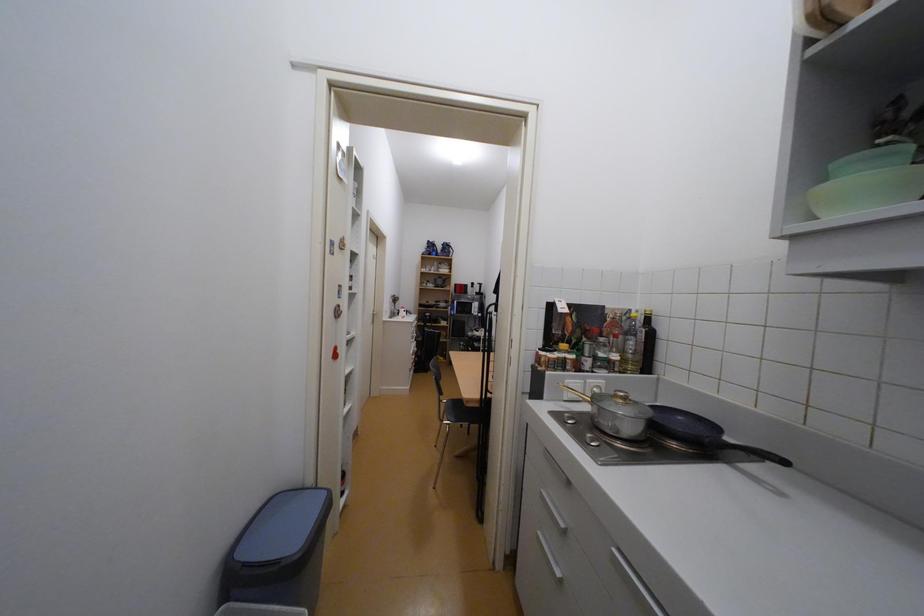
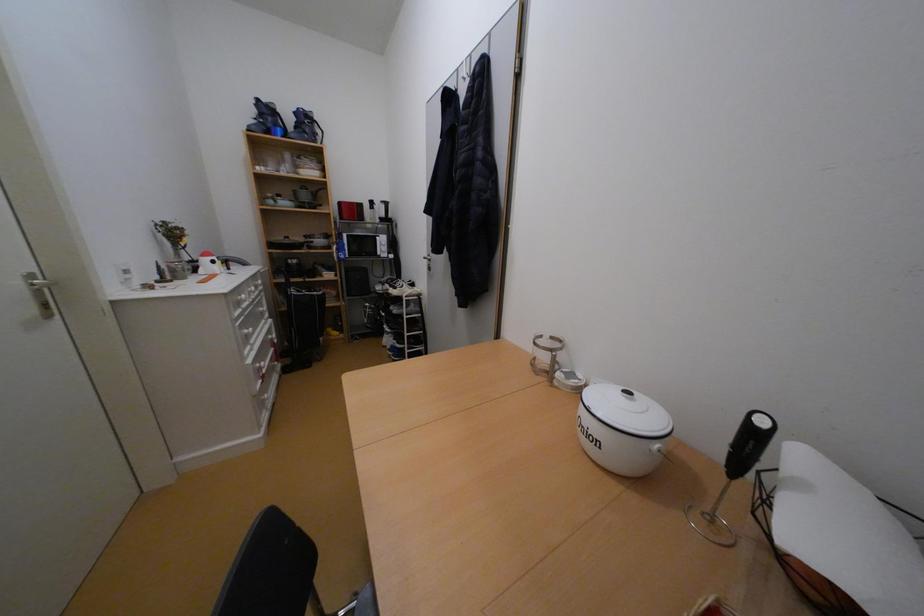
Question: Which direction would the cameraman need to move to produce the second image? Reply with the corresponding letter.

Choices:
 (A) Left
 (B) Right
 (C) Forward
 (D) Backward

Answer: (C)